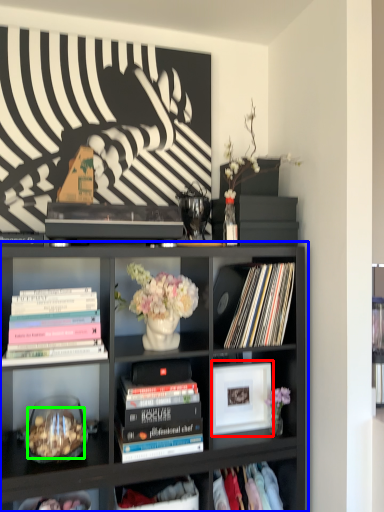
Question: Which object is positioned farthest from picture frame (highlighted by a red box)? Select from bookcase (highlighted by a blue box) and food (highlighted by a green box).

Choices:
 (A) bookcase
 (B) food

Answer: (B)